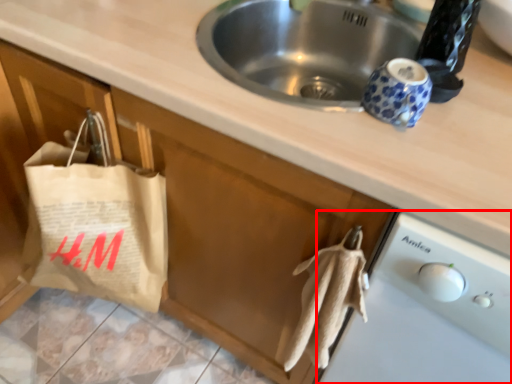
Question: From the image's perspective, what is the correct spatial positioning of dish washer (annotated by the red box) in reference to grocery bag?

Choices:
 (A) below
 (B) above

Answer: (A)